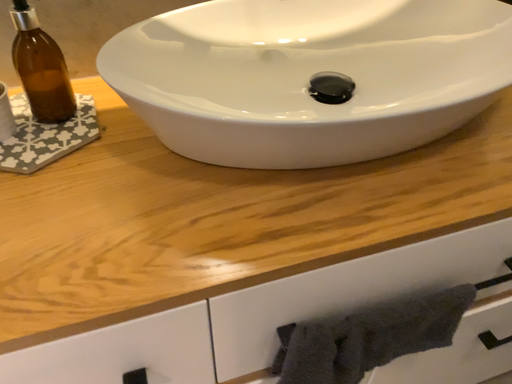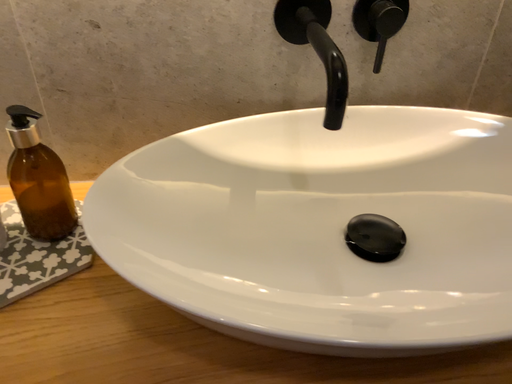
Question: Which way did the camera rotate in the video?

Choices:
 (A) rotated downward
 (B) rotated upward

Answer: (B)